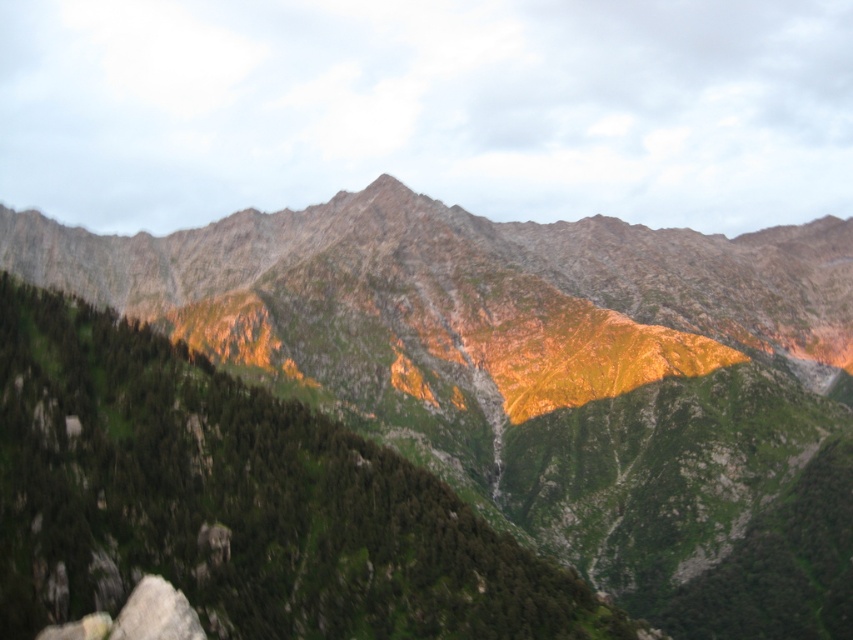
Question: Is green rocky mountain range at center smaller than smooth gray rock at lower left?

Choices:
 (A) no
 (B) yes

Answer: (A)

Question: Which point is farther to the camera?

Choices:
 (A) (463, 464)
 (B) (163, 584)

Answer: (A)

Question: Does green rocky mountain range at center have a lesser width compared to smooth gray rock at lower left?

Choices:
 (A) yes
 (B) no

Answer: (B)

Question: In this image, where is green rocky mountain range at center located relative to smooth gray rock at lower left?

Choices:
 (A) above
 (B) below

Answer: (A)